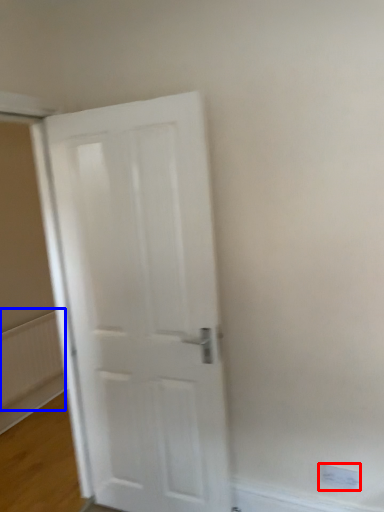
Question: Which of the following is the farthest to the observer, electric outlet (highlighted by a red box) or radiator (highlighted by a blue box)?

Choices:
 (A) electric outlet
 (B) radiator

Answer: (B)